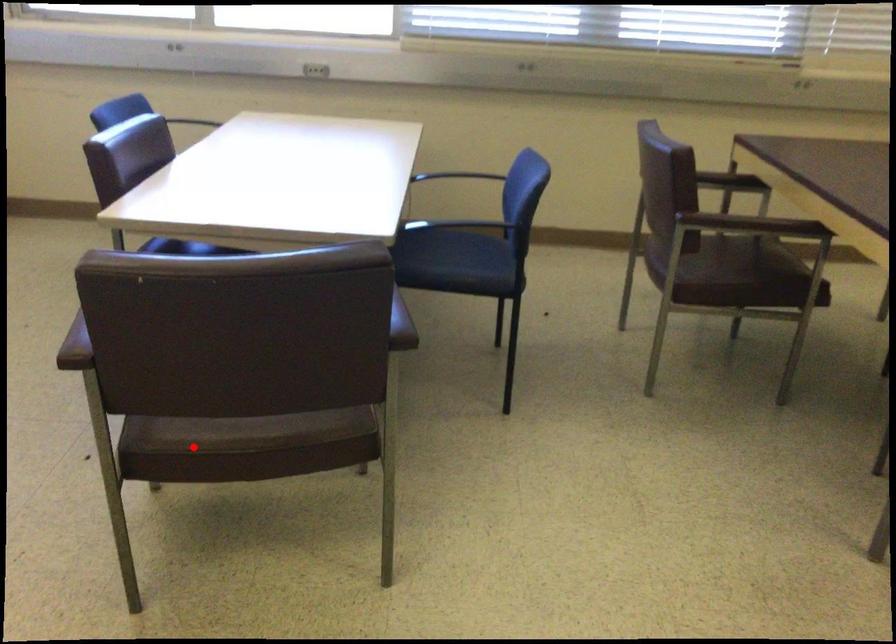
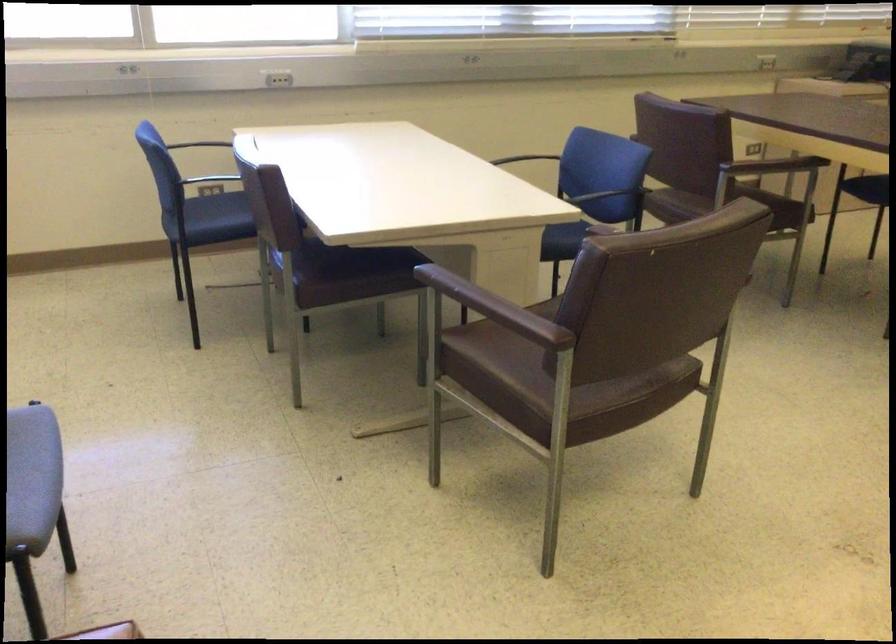
In the second image, find the point that corresponds to the highlighted location in the first image.

(588, 404)